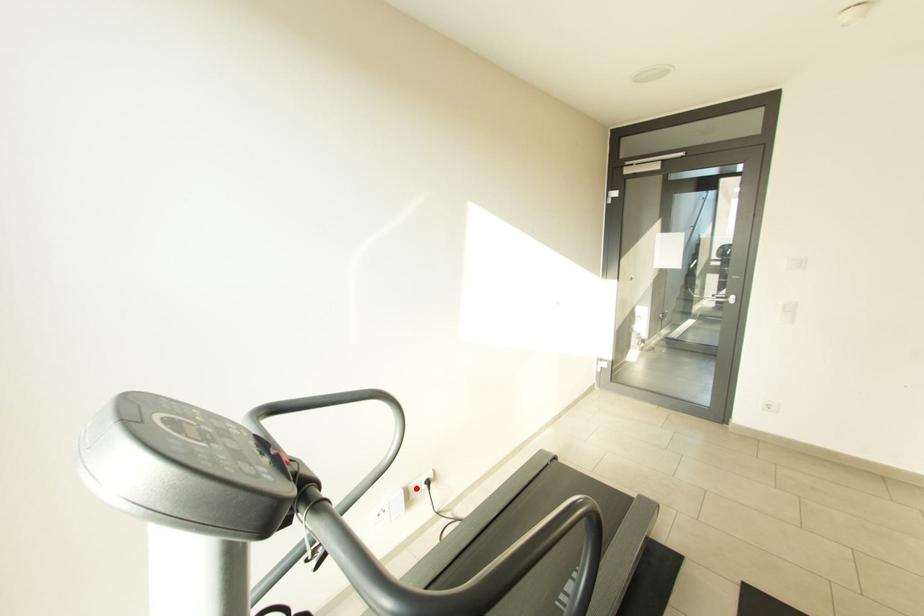
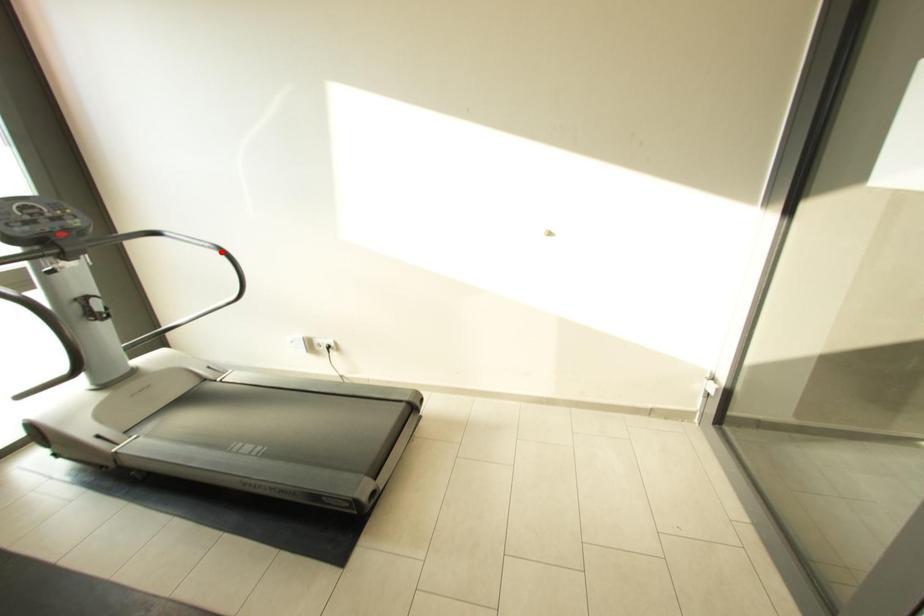
I am providing you with two images of the same scene from different viewpoints. A red point is marked on the first image and another point is marked on the second image. Is the marked point in image1 the same physical position as the marked point in image2?

No